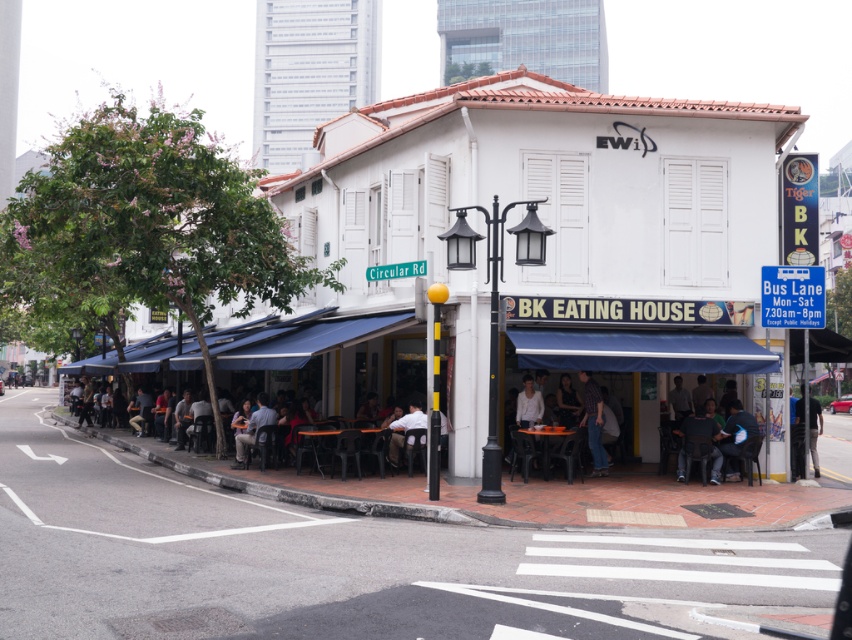
You are a photographer standing in front of the BK Eating House restaurant. You notice two people sitting at tables under the blue awnings. One is wearing a plaid shirt at center and the other a white fabric shirt at center. Which person is closer to you?

The plaid shirt at center is closer to you because it is further to the viewer than the white fabric shirt at center.

You are a photographer trying to capture the entire scene of the BK Eating House. You notice the plaid shirt at center and the blue fabric umbrella at lower right in your frame. Which object takes up more space in the photo?

The blue fabric umbrella at lower right takes up more space in the photo because the plaid shirt at center occupies less space than the blue fabric umbrella at lower right.

You are standing at the entrance of BK Eating House and see two points marked on the ground. The first point is at coordinate point(802, 417) and the second point is at coordinate point(404, 422). Which point is closer to you?

Point(404, 422) is closer to you because it is in front of point(802, 417).